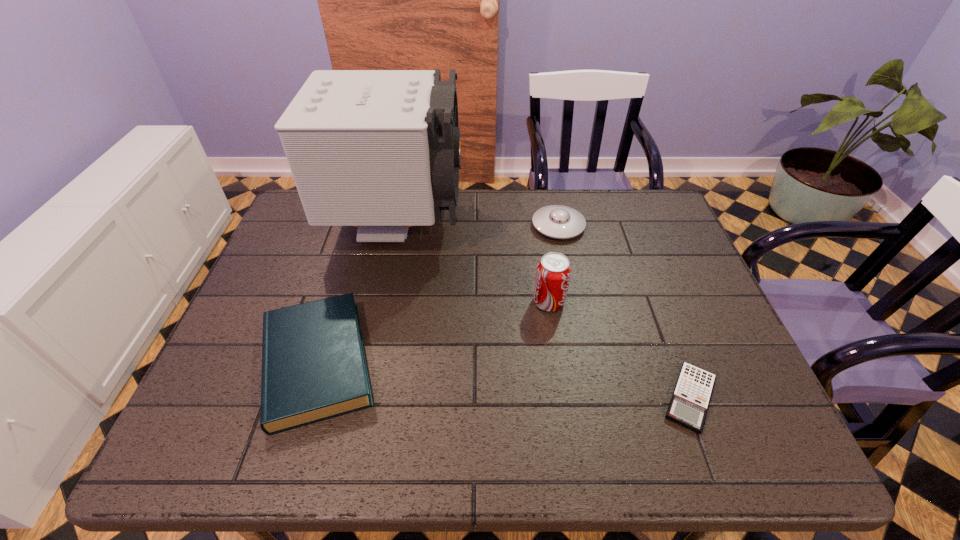
Where is `fan`? The height and width of the screenshot is (540, 960). fan is located at coordinates (380, 150).

Image resolution: width=960 pixels, height=540 pixels. Identify the location of soda. (553, 272).

This screenshot has height=540, width=960. I want to click on saucer, so click(x=556, y=221).

The width and height of the screenshot is (960, 540). I want to click on book, so click(x=314, y=368).

At what (x,y) coordinates should I click in order to perform the action: click on the rightmost object. Please return your answer as a coordinate pair (x, y). This screenshot has height=540, width=960. Looking at the image, I should click on (688, 407).

The height and width of the screenshot is (540, 960). In order to click on the shortest object in this screenshot , I will do `click(688, 407)`.

This screenshot has height=540, width=960. What are the coordinates of `vacant space situated on the front of the tallest object` in the screenshot? It's located at (363, 389).

In order to click on free spot located 0.060m on the right of the fourth shortest object in this screenshot , I will do `click(588, 302)`.

Where is `vacant space positioned 0.300m on the left of the saucer`? The height and width of the screenshot is (540, 960). vacant space positioned 0.300m on the left of the saucer is located at coordinates (434, 226).

Where is `free point located 0.060m on the back of the book`? Image resolution: width=960 pixels, height=540 pixels. free point located 0.060m on the back of the book is located at coordinates (340, 288).